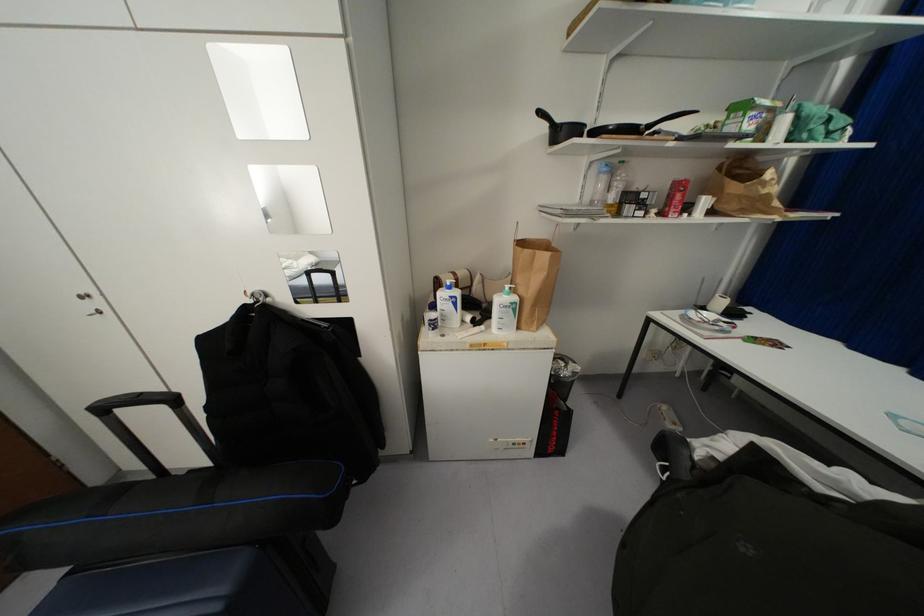
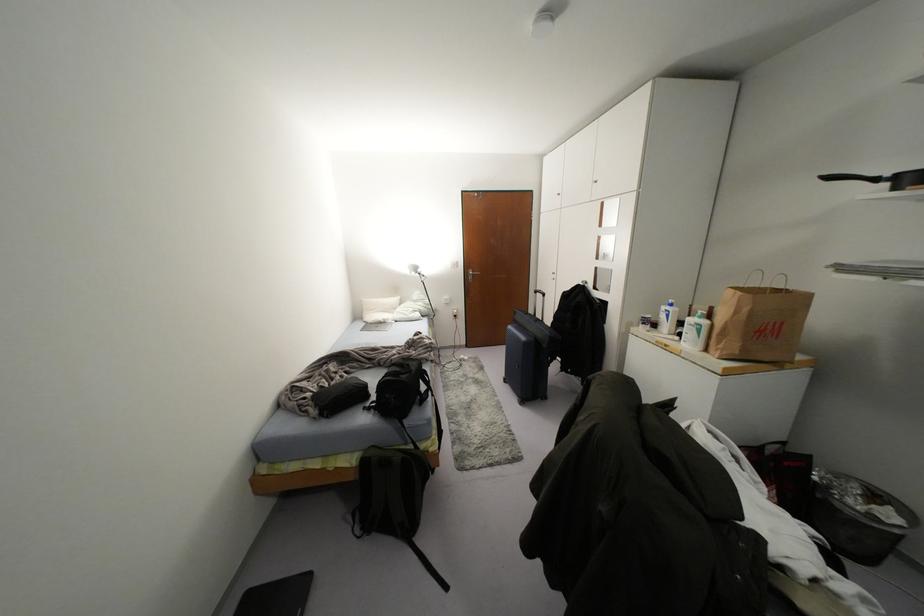
In the second image, find the point that corresponds to (x=175, y=400) in the first image.

(542, 294)